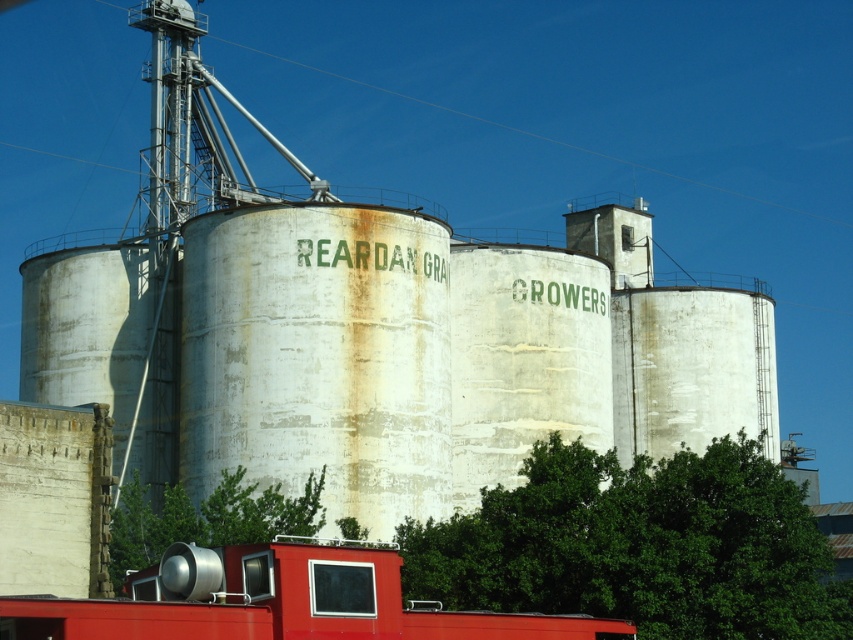
You are a delivery driver who needs to park your trailer truck. You see a metallic trailer truck at lower center and a green leafy tree at lower center in the image. Is there enough space to park the trailer truck under the tree without hitting the branches?

The metallic trailer truck at lower center is positioned under green leafy tree at lower center, so yes, there is enough space to park the trailer truck under the tree without hitting the branches.

You are standing at the entrance of the silo complex and see the metallic trailer truck at lower center and the green leafy tree at lower center. Which object is positioned to the right side from your viewpoint?

The metallic trailer truck at lower center is positioned to the right of the green leafy tree at lower center from your viewpoint.